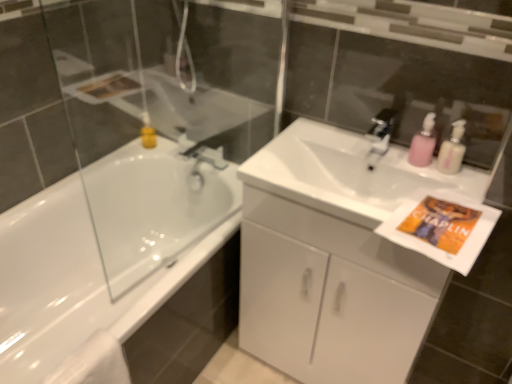
Where is `vacant space situated on the left part of pink plastic soap dispenser at upper right`? vacant space situated on the left part of pink plastic soap dispenser at upper right is located at coordinates (368, 158).